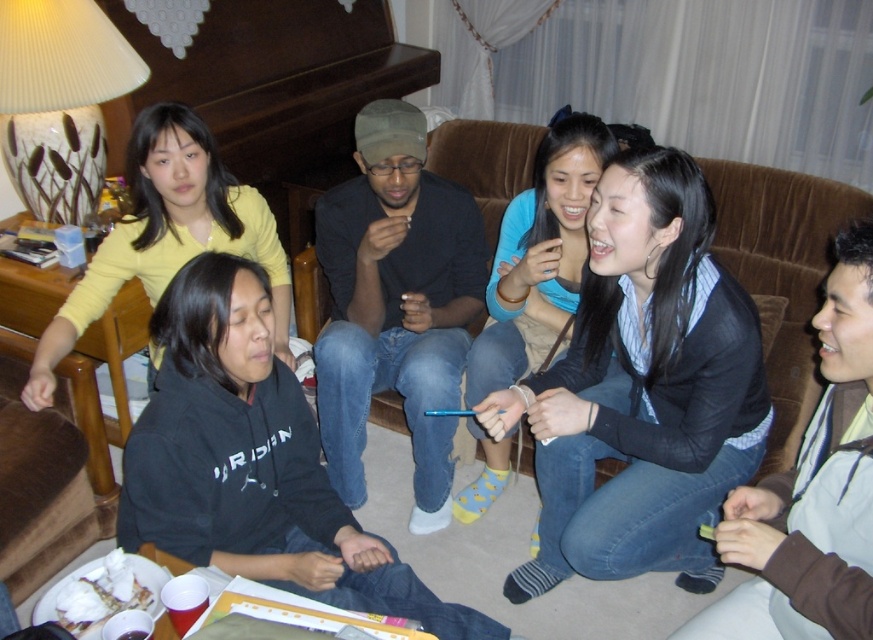
Question: Can you confirm if matte black jacket at center is bigger than blue cotton socks at center?

Choices:
 (A) no
 (B) yes

Answer: (B)

Question: Which point is farther to the camera?

Choices:
 (A) (740, 312)
 (B) (56, 353)

Answer: (B)

Question: Among these objects, which one is farthest from the camera?

Choices:
 (A) blue cotton socks at center
 (B) matte black jacket at center

Answer: (A)

Question: Which object is positioned closest to the blue cotton socks at center?

Choices:
 (A) yellow matte shirt at upper left
 (B) matte black jacket at center

Answer: (B)

Question: Considering the relative positions of matte black jacket at center and blue cotton socks at center in the image provided, where is matte black jacket at center located with respect to blue cotton socks at center?

Choices:
 (A) above
 (B) below

Answer: (B)

Question: Can you confirm if matte black jacket at center is positioned to the right of blue cotton socks at center?

Choices:
 (A) yes
 (B) no

Answer: (A)